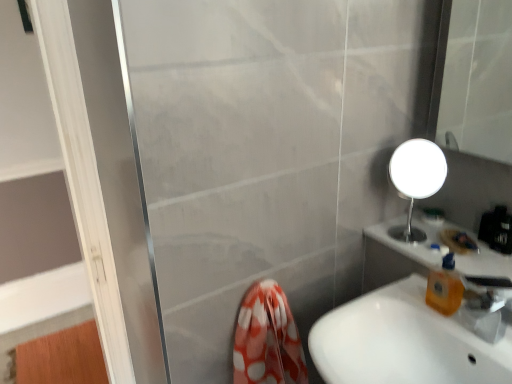
Question: Considering the relative sizes of white glossy sink at lower right and transparent plastic tap at lower right in the image provided, is white glossy sink at lower right smaller than transparent plastic tap at lower right?

Choices:
 (A) no
 (B) yes

Answer: (A)

Question: Is white glossy sink at lower right far away from transparent plastic tap at lower right?

Choices:
 (A) no
 (B) yes

Answer: (A)

Question: Is white glossy sink at lower right further to camera compared to transparent plastic tap at lower right?

Choices:
 (A) yes
 (B) no

Answer: (B)

Question: Considering the relative positions of white glossy sink at lower right and transparent plastic tap at lower right in the image provided, is white glossy sink at lower right to the right of transparent plastic tap at lower right from the viewer's perspective?

Choices:
 (A) yes
 (B) no

Answer: (B)

Question: Is white glossy sink at lower right oriented towards transparent plastic tap at lower right?

Choices:
 (A) no
 (B) yes

Answer: (A)

Question: Does white glossy sink at lower right have a greater height compared to transparent plastic tap at lower right?

Choices:
 (A) no
 (B) yes

Answer: (B)

Question: Is orange translucent soap dispenser at right aimed at transparent plastic tap at lower right?

Choices:
 (A) no
 (B) yes

Answer: (A)

Question: Considering the relative positions of orange translucent soap dispenser at right and transparent plastic tap at lower right in the image provided, is orange translucent soap dispenser at right to the left of transparent plastic tap at lower right from the viewer's perspective?

Choices:
 (A) yes
 (B) no

Answer: (A)

Question: Is the depth of orange translucent soap dispenser at right less than that of transparent plastic tap at lower right?

Choices:
 (A) yes
 (B) no

Answer: (B)

Question: Is orange translucent soap dispenser at right bigger than transparent plastic tap at lower right?

Choices:
 (A) no
 (B) yes

Answer: (A)

Question: Considering the relative sizes of orange translucent soap dispenser at right and transparent plastic tap at lower right in the image provided, is orange translucent soap dispenser at right wider than transparent plastic tap at lower right?

Choices:
 (A) no
 (B) yes

Answer: (A)

Question: Is orange translucent soap dispenser at right positioned with its back to transparent plastic tap at lower right?

Choices:
 (A) no
 (B) yes

Answer: (A)

Question: Is transparent plastic tap at lower right at the right side of white glossy sink at lower right?

Choices:
 (A) yes
 (B) no

Answer: (A)